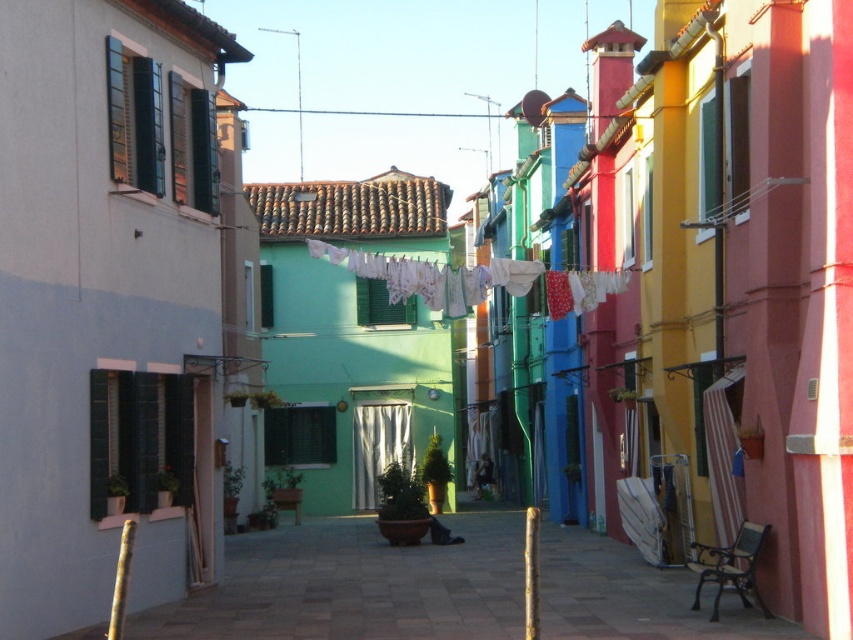
You are standing on the cobblestone street in the village and notice two points marked in the scene. The first point is at coordinates point (206, 593) and the second is at point (453, 307). Which point is closer to you?

Point (206, 593) is closer to the viewer than point (453, 307).

You are a delivery person with a 1.8 meter tall box that needs to be carried through the smooth concrete alley at center. There is also a white fabric clothesline at center in the image. Can you pass through the alley without hitting the clothesline?

The smooth concrete alley at center is not as tall as the white fabric clothesline at center, meaning the alley is shorter in height. Since the box is 1.8 meters tall, it may hit the clothesline if the alley is not tall enough. However, the exact height of the alley isn not provided, so it is uncertain. But according to the description, the alley is shorter than the clothesline, implying the clothesline is higher. Therefore, the box might clear the alley safely.

You are a delivery person carrying a package that is 6 feet wide. You need to navigate through the smooth concrete alley at center and pass under the white fabric clothesline at center. Can your package fit through without touching the clothesline?

The smooth concrete alley at center is 17.32 feet away from the white fabric clothesline at center. Since the package is only 6 feet wide, it can easily pass through the alley without touching the clothesline as the distance between them is more than sufficient.